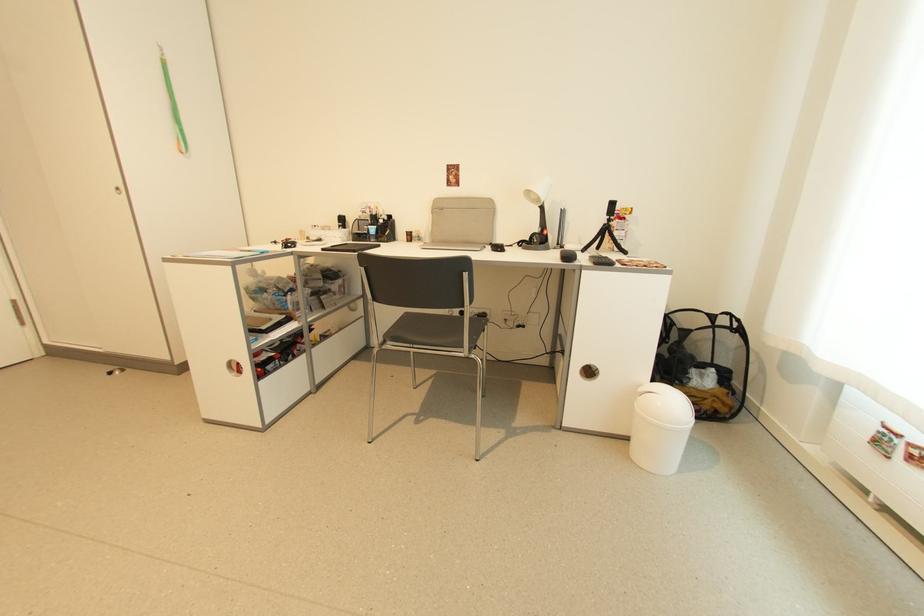
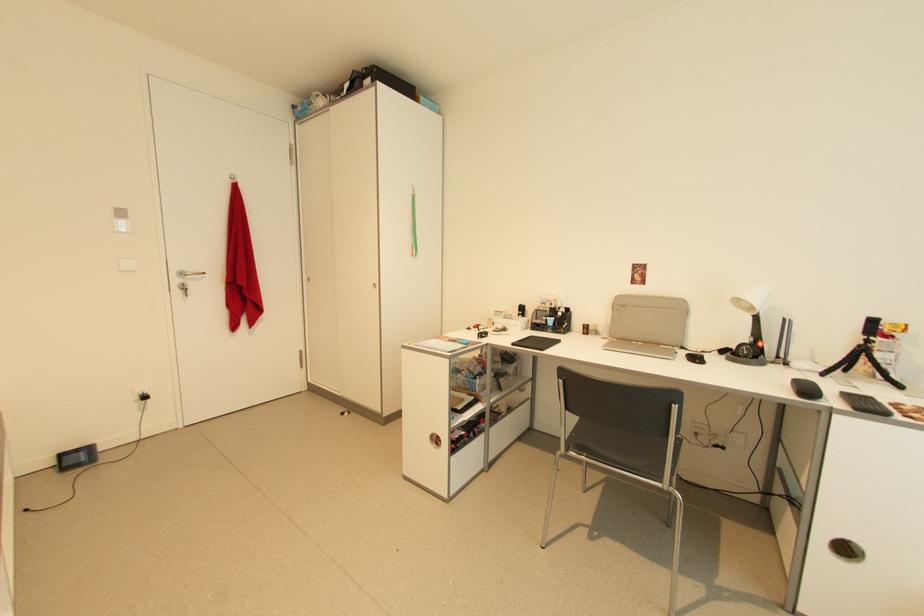
In a continuous first-person perspective shot, in which direction is the camera moving?

The movement direction of the cameraman is left, backward.